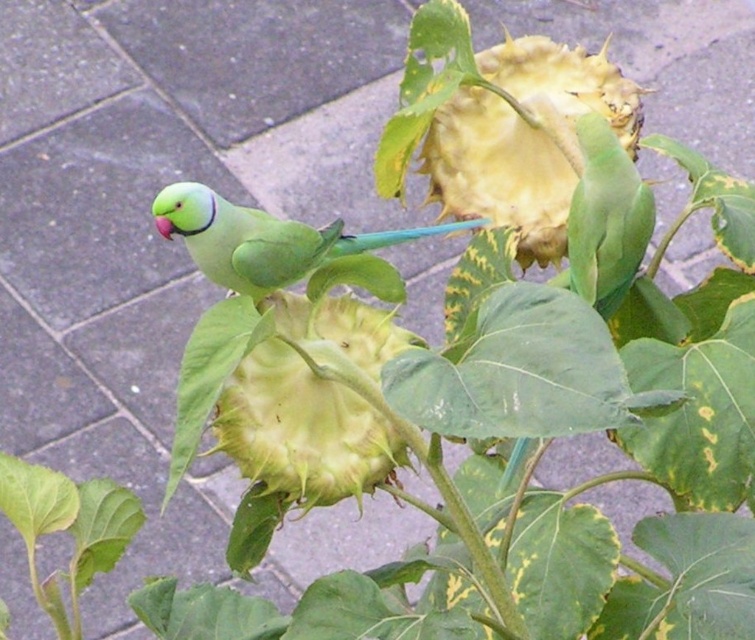
Question: Which is nearer to the green matte sunflower at center?

Choices:
 (A) yellowish-green textured sunflower at center
 (B) green matte parrot at left
 (C) green matte parrot at upper right

Answer: (B)

Question: Which point is farther to the camera?

Choices:
 (A) (302, 240)
 (B) (513, 170)

Answer: (B)

Question: Does green matte sunflower at center lie in front of green matte parrot at left?

Choices:
 (A) no
 (B) yes

Answer: (B)

Question: Is green matte sunflower at center smaller than green matte parrot at left?

Choices:
 (A) no
 (B) yes

Answer: (B)

Question: Which point is closer to the camera?

Choices:
 (A) green matte parrot at upper right
 (B) green matte sunflower at center
 (C) yellowish-green textured sunflower at center
 (D) green matte parrot at left

Answer: (B)

Question: Does yellowish-green textured sunflower at center have a larger size compared to green matte parrot at upper right?

Choices:
 (A) no
 (B) yes

Answer: (B)